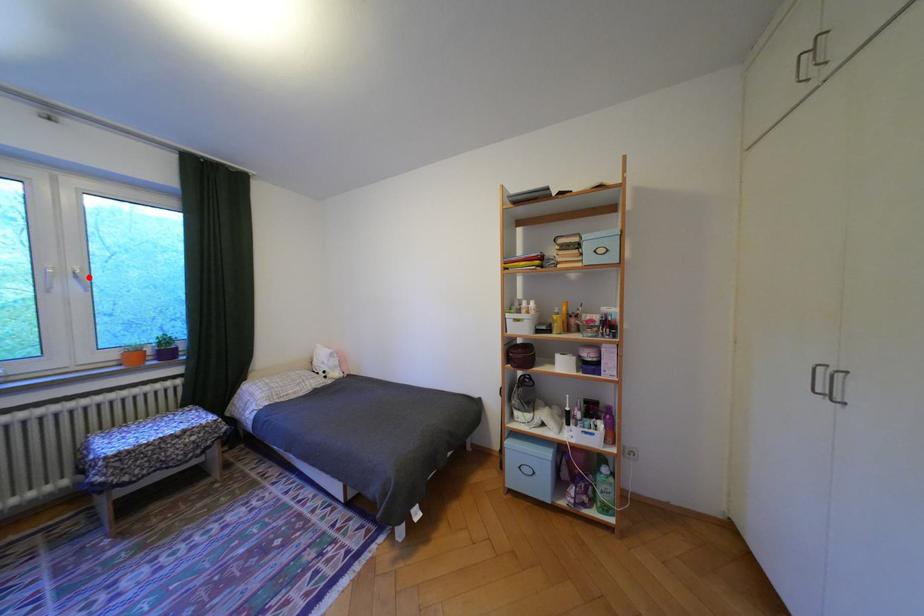
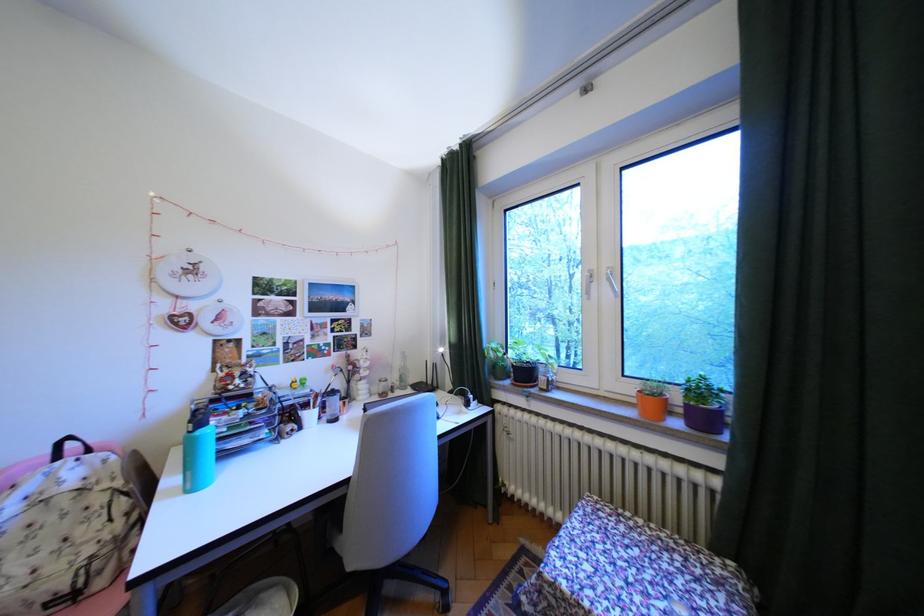
Where in the second image is the point corresponding to the highlighted location from the first image?

(621, 280)